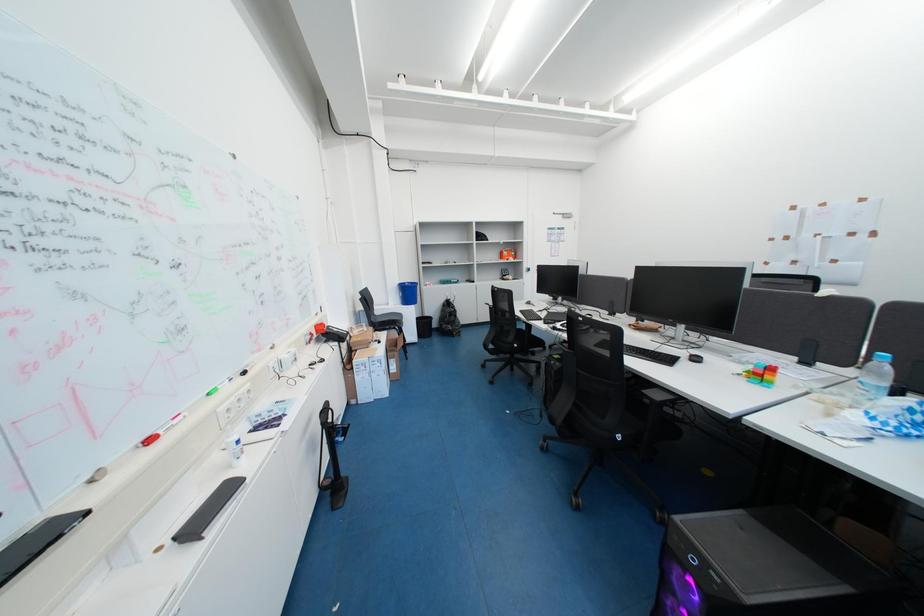
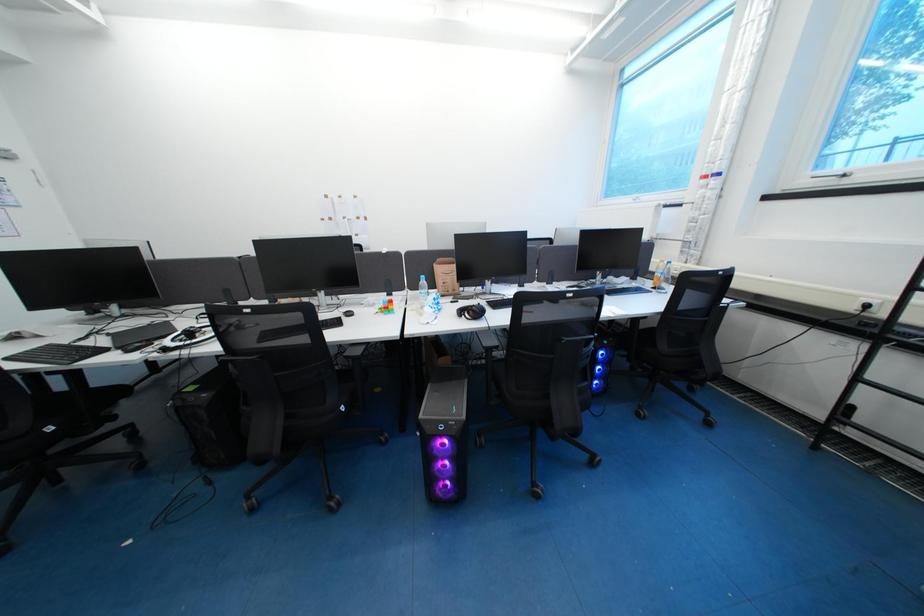
How did the camera likely rotate?

The camera rotated toward right-down.